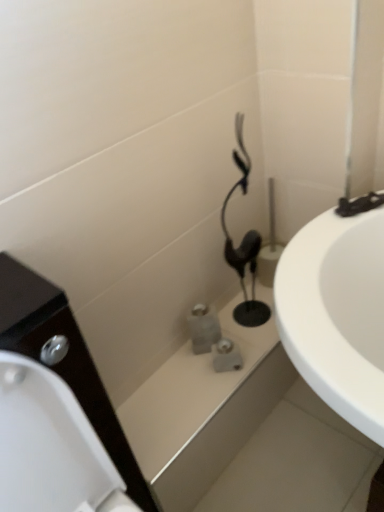
Question: Is black plastic hairdryer at center at the back of white glossy bath at center, which is counted as the 1th bath, starting from the front?

Choices:
 (A) no
 (B) yes

Answer: (A)

Question: Is white glossy bath at center, acting as the 2th bath starting from the back, smaller than black plastic hairdryer at center?

Choices:
 (A) no
 (B) yes

Answer: (A)

Question: From the image's perspective, is white glossy bath at center, acting as the 2th bath starting from the back, on black plastic hairdryer at center?

Choices:
 (A) yes
 (B) no

Answer: (B)

Question: Is white glossy bath at center, acting as the 2th bath starting from the back, positioned before black plastic hairdryer at center?

Choices:
 (A) no
 (B) yes

Answer: (B)

Question: Does white glossy bath at center, acting as the 2th bath starting from the back, have a greater width compared to black plastic hairdryer at center?

Choices:
 (A) no
 (B) yes

Answer: (B)

Question: Considering the positions of matte gray stone bath at center, the 2th bath from the front, and white glossy bath at center, acting as the 2th bath starting from the back, in the image, is matte gray stone bath at center, the 2th bath from the front, bigger or smaller than white glossy bath at center, acting as the 2th bath starting from the back,?

Choices:
 (A) small
 (B) big

Answer: (A)

Question: Is matte gray stone bath at center, the first bath from the back, spatially inside white glossy bath at center, acting as the 2th bath starting from the back, or outside of it?

Choices:
 (A) inside
 (B) outside

Answer: (B)

Question: Considering the positions of matte gray stone bath at center, the first bath from the back, and white glossy bath at center, which is counted as the 1th bath, starting from the front, in the image, is matte gray stone bath at center, the first bath from the back, wider or thinner than white glossy bath at center, which is counted as the 1th bath, starting from the front,?

Choices:
 (A) thin
 (B) wide

Answer: (A)

Question: Is point (228, 313) positioned closer to the camera than point (258, 380)?

Choices:
 (A) farther
 (B) closer

Answer: (A)

Question: In the image, is black plastic hairdryer at center positioned in front of or behind matte gray stone bath at center, the 2th bath from the front?

Choices:
 (A) front
 (B) behind

Answer: (A)

Question: Considering the positions of black plastic hairdryer at center and matte gray stone bath at center, the 2th bath from the front, in the image, is black plastic hairdryer at center taller or shorter than matte gray stone bath at center, the 2th bath from the front,?

Choices:
 (A) short
 (B) tall

Answer: (B)

Question: Would you say black plastic hairdryer at center is to the left or to the right of matte gray stone bath at center, the first bath from the back, in the picture?

Choices:
 (A) right
 (B) left

Answer: (A)

Question: Considering the positions of point (228, 252) and point (236, 303), is point (228, 252) closer or farther from the camera than point (236, 303)?

Choices:
 (A) closer
 (B) farther

Answer: (A)

Question: From the image's perspective, is matte gray stone bath at center, the first bath from the back, above or below black plastic hairdryer at center?

Choices:
 (A) below
 (B) above

Answer: (A)

Question: Which is correct: matte gray stone bath at center, the 2th bath from the front, is inside black plastic hairdryer at center, or outside of it?

Choices:
 (A) outside
 (B) inside

Answer: (A)